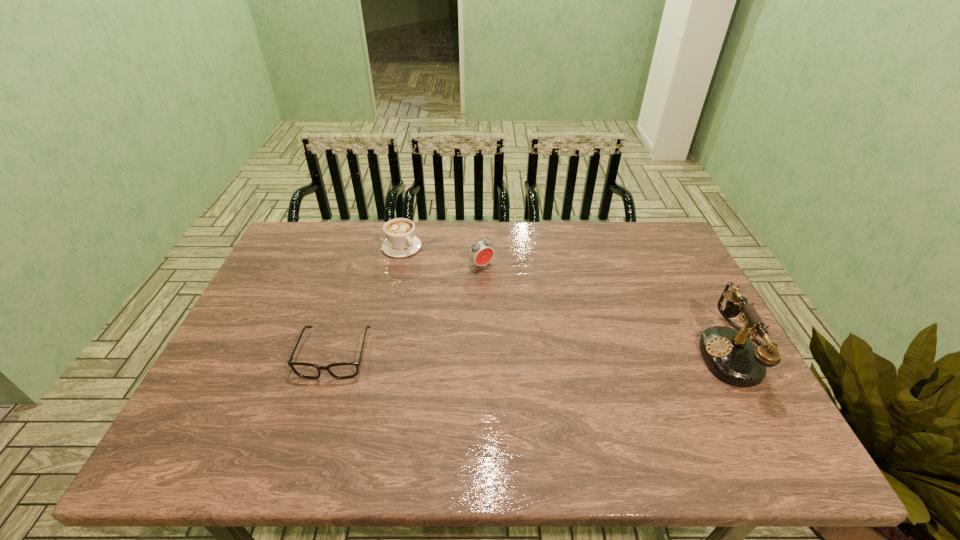
This screenshot has width=960, height=540. In order to click on object at the near right corner in this screenshot , I will do `click(730, 354)`.

The height and width of the screenshot is (540, 960). In the image, there is a desktop. In order to click on vacant space at the far edge in this screenshot , I will do `click(353, 265)`.

You are a GUI agent. You are given a task and a screenshot of the screen. Output one action in this format:
    pyautogui.click(x=<x>, y=<y>)
    Task: Click on the vacant space at the near edge
    This screenshot has height=540, width=960.
    Given the screenshot: What is the action you would take?
    pyautogui.click(x=460, y=412)

Locate an element on the screen. This screenshot has width=960, height=540. vacant region at the left edge of the desktop is located at coordinates (281, 277).

I want to click on free space at the right edge, so click(686, 343).

This screenshot has width=960, height=540. Find the location of `vacant space at the far left corner of the desktop`. vacant space at the far left corner of the desktop is located at coordinates (304, 227).

This screenshot has width=960, height=540. I want to click on free region at the near left corner of the desktop, so click(x=260, y=402).

Where is `free spot between the spectacles and the telephone`? This screenshot has width=960, height=540. free spot between the spectacles and the telephone is located at coordinates (536, 354).

Find the location of a particular element. Image resolution: width=960 pixels, height=540 pixels. free spot between the rightmost object and the third nearest object is located at coordinates (609, 309).

Where is `vacant point located between the spectacles and the farthest object`? Image resolution: width=960 pixels, height=540 pixels. vacant point located between the spectacles and the farthest object is located at coordinates (369, 301).